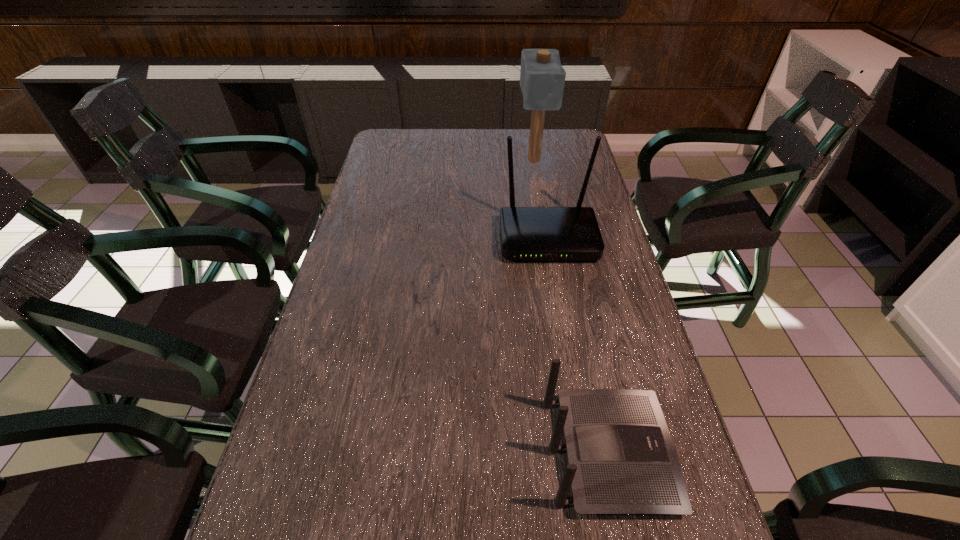
Where is `mallet`? The height and width of the screenshot is (540, 960). mallet is located at coordinates (542, 77).

At what (x,y) coordinates should I click in order to perform the action: click on the farthest object. Please return your answer as a coordinate pair (x, y). This screenshot has height=540, width=960. Looking at the image, I should click on (542, 77).

Locate an element on the screen. The width and height of the screenshot is (960, 540). the second shortest object is located at coordinates pos(527,233).

This screenshot has width=960, height=540. Find the location of `the farther router`. the farther router is located at coordinates (527, 233).

Where is `the nearer router`? The image size is (960, 540). the nearer router is located at coordinates (621, 458).

At what (x,y) coordinates should I click in order to perform the action: click on the nearest object. Please return your answer as a coordinate pair (x, y). Looking at the image, I should click on (621, 458).

Image resolution: width=960 pixels, height=540 pixels. I want to click on vacant space located on the left of the mallet, so click(484, 160).

This screenshot has height=540, width=960. I want to click on free spot located 0.180m on the front-facing side of the taller router, so click(x=561, y=315).

Where is `object that is at the far edge`? The height and width of the screenshot is (540, 960). object that is at the far edge is located at coordinates (542, 77).

You are a GUI agent. You are given a task and a screenshot of the screen. Output one action in this format:
    pyautogui.click(x=<x>, y=<y>)
    Task: Click on the mallet that is positioned at the right edge
    This screenshot has height=540, width=960.
    Given the screenshot: What is the action you would take?
    pyautogui.click(x=542, y=77)